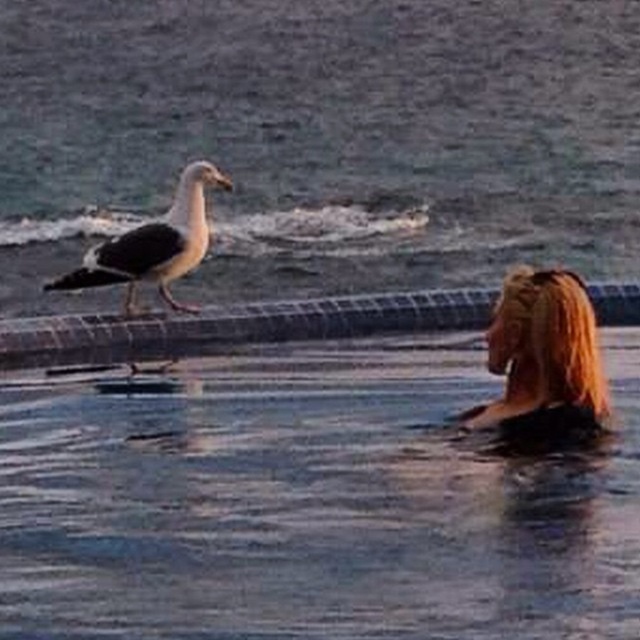
Question: Among these objects, which one is nearest to the camera?

Choices:
 (A) black-feathered seagull at left
 (B) blonde hair at upper right

Answer: (B)

Question: Which of the following is the farthest from the observer?

Choices:
 (A) (202, 170)
 (B) (545, 269)

Answer: (A)

Question: Is blonde hair at upper right below black-feathered seagull at left?

Choices:
 (A) no
 (B) yes

Answer: (B)

Question: Is blonde hair at upper right bigger than black-feathered seagull at left?

Choices:
 (A) yes
 (B) no

Answer: (B)

Question: Which point is farther to the camera?

Choices:
 (A) black-feathered seagull at left
 (B) blonde hair at upper right

Answer: (A)

Question: Does blonde hair at upper right have a greater width compared to black-feathered seagull at left?

Choices:
 (A) yes
 (B) no

Answer: (B)